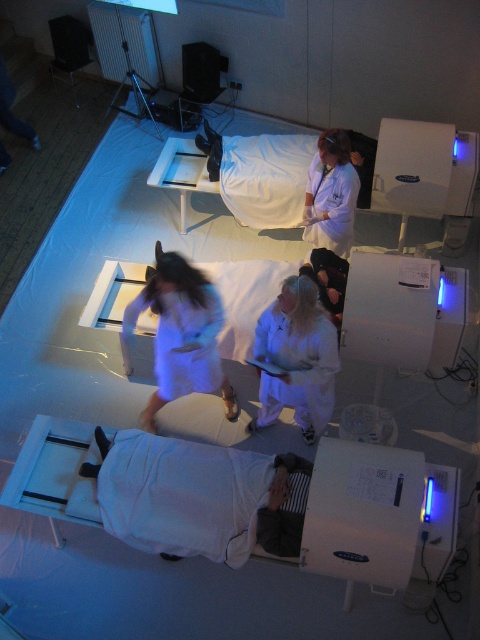
You are a researcher in the lab and need to place the white matte lab coat at upper center on the white fabric bed at center. Can you do this without folding it?

The white fabric bed at center is much taller than the white matte lab coat at upper center. Since the bed is taller, you can place the lab coat on it without folding as there is enough vertical space.